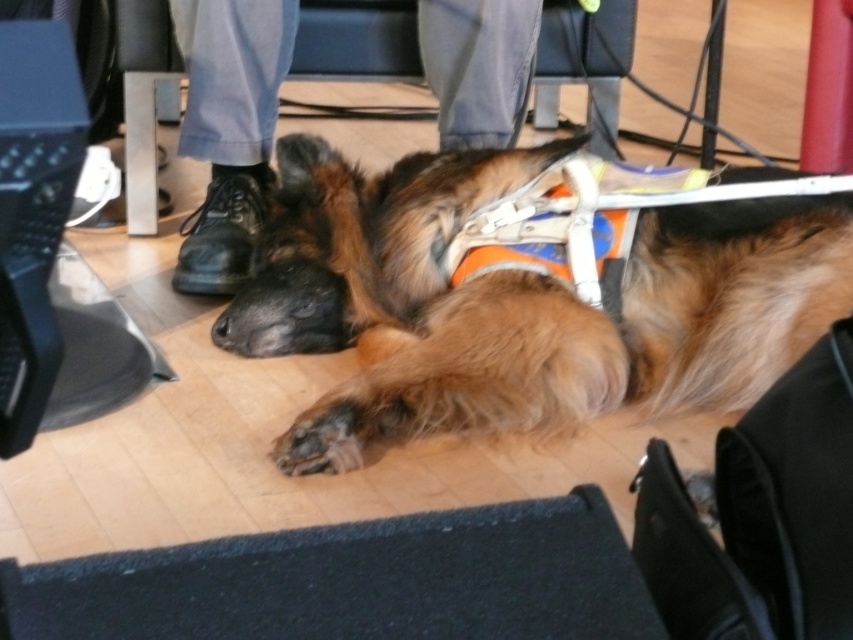
Between brown fur dog at center and black leather shoes at lower center, which one is positioned lower?

Positioned lower is brown fur dog at center.

Does brown fur dog at center appear on the right side of black leather shoes at lower center?

Indeed, brown fur dog at center is positioned on the right side of black leather shoes at lower center.

The height and width of the screenshot is (640, 853). In order to click on brown fur dog at center in this screenshot , I will do `click(520, 301)`.

Does black leather shoes at lower center appear on the right side of black leather shoes at lower left?

A: No, black leather shoes at lower center is not to the right of black leather shoes at lower left.

Does black leather shoes at lower center come behind black leather shoes at lower left?

Yes, it is.

Which is behind, point (454, 76) or point (254, 228)?

The point (254, 228) is behind.

Locate an element on the screen. The width and height of the screenshot is (853, 640). black leather shoes at lower center is located at coordinates 229,129.

Does brown fur dog at center come in front of black leather shoes at lower left?

Yes, it is.

Can you confirm if brown fur dog at center is positioned to the left of black leather shoes at lower left?

Incorrect, brown fur dog at center is not on the left side of black leather shoes at lower left.

Is point (335, 209) positioned behind point (263, 19)?

No, it is not.

Identify the location of brown fur dog at center. Image resolution: width=853 pixels, height=640 pixels. (520, 301).